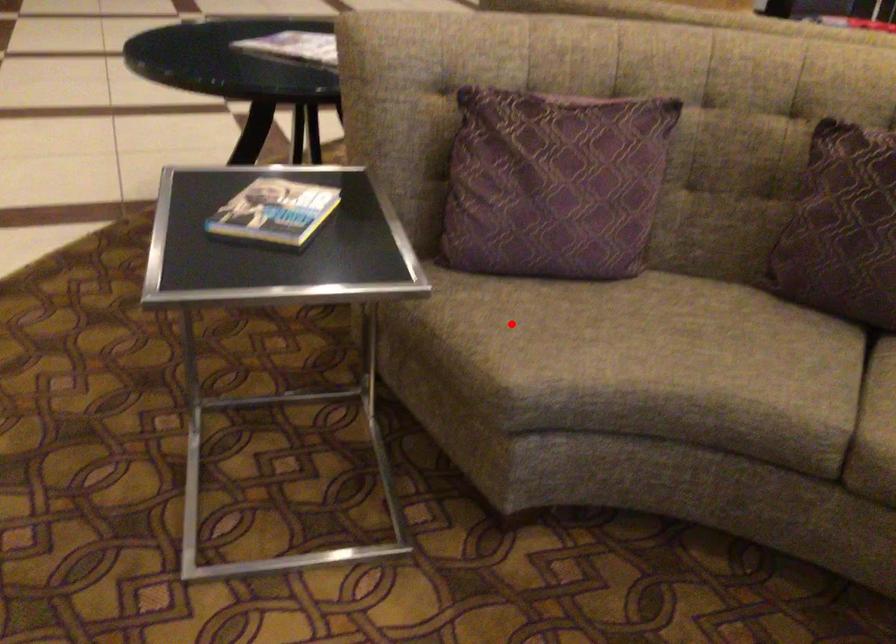
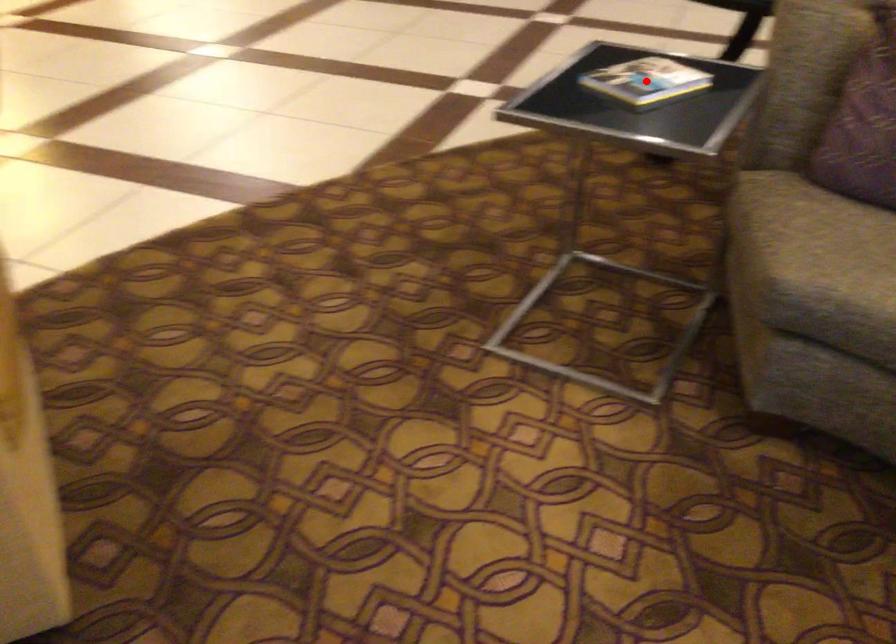
I am providing you with two images of the same scene from different viewpoints. A red point is marked on the first image and another point is marked on the second image. Is the marked point in image1 the same physical position as the marked point in image2?

No